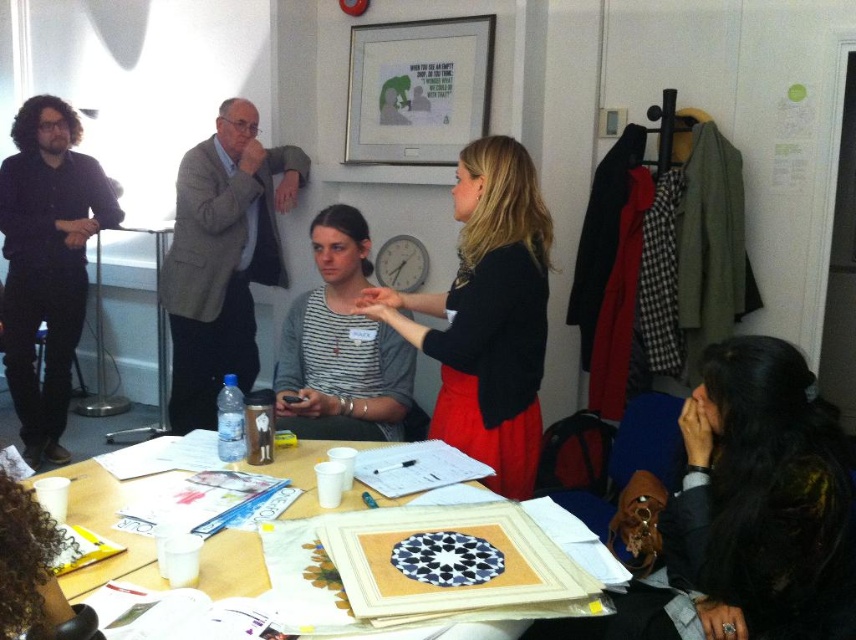
Between striped fabric shirt at center and wooden table at center, which one has less height?

Standing shorter between the two is wooden table at center.

Can you confirm if striped fabric shirt at center is positioned to the left of wooden table at center?

Yes, striped fabric shirt at center is to the left of wooden table at center.

The image size is (856, 640). In order to click on striped fabric shirt at center in this screenshot , I will do `click(340, 346)`.

You are a GUI agent. You are given a task and a screenshot of the screen. Output one action in this format:
    pyautogui.click(x=<x>, y=<y>)
    Task: Click on the striped fabric shirt at center
    
    Given the screenshot: What is the action you would take?
    pyautogui.click(x=340, y=346)

Does point (502, 412) come closer to viewer compared to point (295, 516)?

That is False.

Between point (453, 189) and point (232, 564), which one is positioned behind?

Positioned behind is point (453, 189).

At what (x,y) coordinates should I click in order to perform the action: click on black matte skirt at center. Please return your answer as a coordinate pair (x, y). The width and height of the screenshot is (856, 640). Looking at the image, I should click on (486, 316).

Between point (449, 132) and point (152, 557), which one is positioned in front?

Point (152, 557) is in front.

Image resolution: width=856 pixels, height=640 pixels. What do you see at coordinates (417, 90) in the screenshot?
I see `matte silver picture frame at upper center` at bounding box center [417, 90].

Find the location of a particular element. matte silver picture frame at upper center is located at coordinates (417, 90).